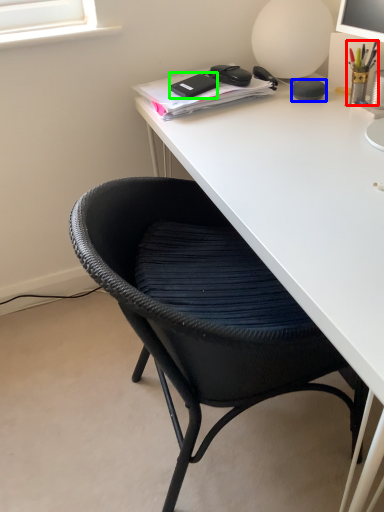
Question: Which object is positioned farthest from stationery (highlighted by a red box)? Select from stationery (highlighted by a blue box) and stationery (highlighted by a green box).

Choices:
 (A) stationery
 (B) stationery

Answer: (B)